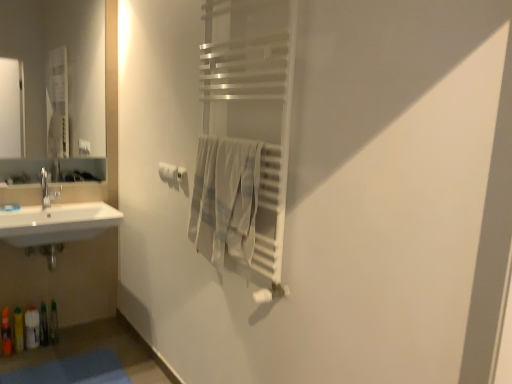
This screenshot has height=384, width=512. Identify the location of free point in front of translucent plastic bottles at lower left, positioned as the 1th toiletry in right-to-left order. (44, 353).